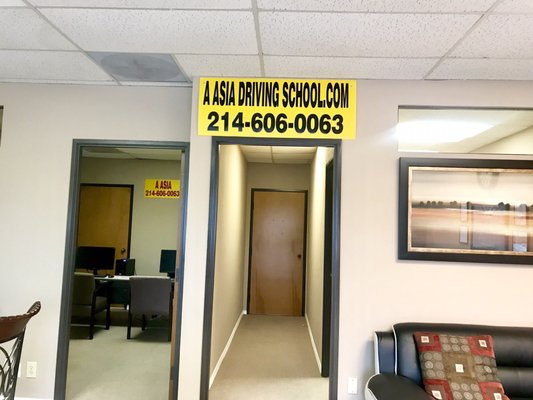
The width and height of the screenshot is (533, 400). What are the coordinates of `chair` in the screenshot? It's located at (21, 326).